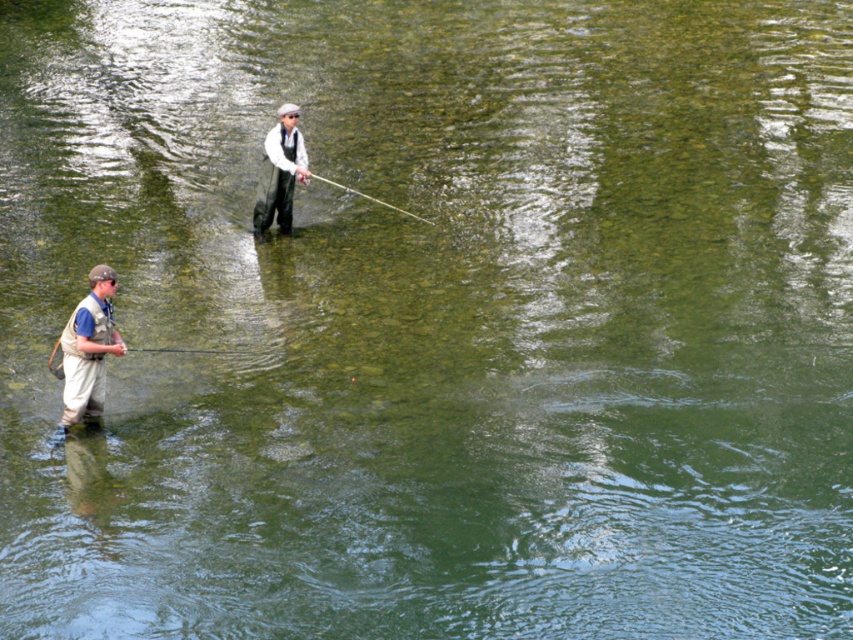
You are standing at the point labeled point (83, 355) and want to take a photo of the two fly fishers. The camera you have can focus on subjects within 10 meters. Will the camera be able to capture the fishers clearly?

The distance between point (83, 355) and the camera is 12.13 meters, which exceeds the camera focus range of 10 meters. Therefore, the camera cannot capture the fishers clearly.

You are a photographer trying to capture a clear shot of the smooth rod at center and the light brown fabric vest at lower left. Since the vest is taller than the rod, which object will appear larger in the photo?

The light brown fabric vest at lower left is taller than the smooth rod at center, so it will appear larger in the photo.

You are observing two people fly fishing by a river. You notice a light brown fabric vest at lower left. Based on its position, can you determine if it is closer to the water surface or the riverbank?

The light brown fabric vest at lower left is located at point (90,348), which places it closer to the riverbank than the water surface.